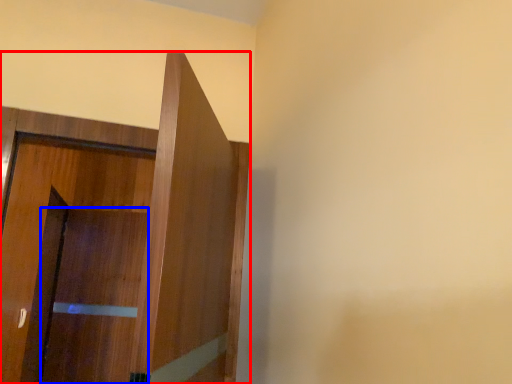
Question: Which object appears farthest to the camera in this image, door (highlighted by a red box) or screen door (highlighted by a blue box)?

Choices:
 (A) door
 (B) screen door

Answer: (B)